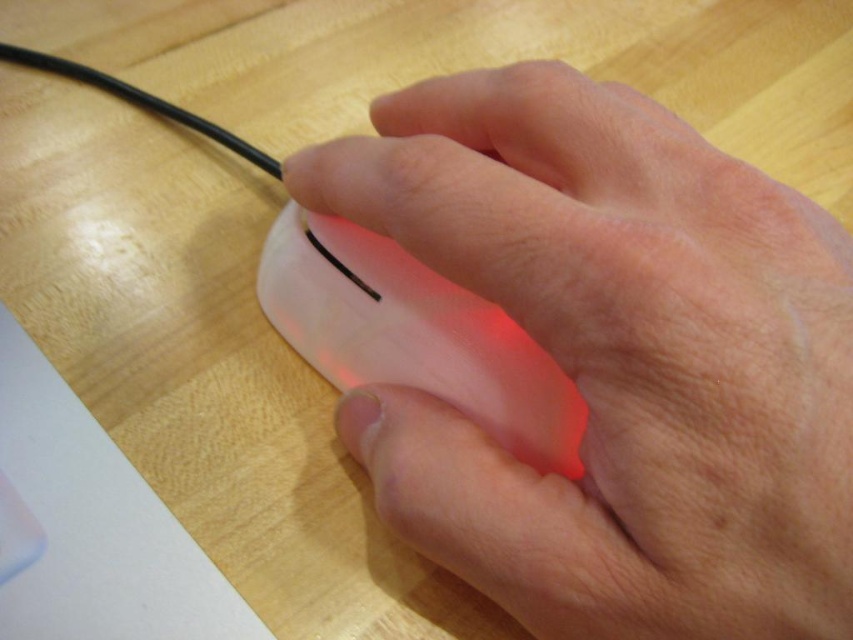
Question: Can you confirm if white matte mouse at center is positioned to the left of translucent plastic mouse at center?

Choices:
 (A) yes
 (B) no

Answer: (B)

Question: Can you confirm if white matte mouse at center is positioned below translucent plastic mouse at center?

Choices:
 (A) yes
 (B) no

Answer: (B)

Question: Among these objects, which one is nearest to the camera?

Choices:
 (A) white matte mouse at center
 (B) translucent plastic mouse at center

Answer: (A)

Question: Is white matte mouse at center closer to camera compared to translucent plastic mouse at center?

Choices:
 (A) yes
 (B) no

Answer: (A)